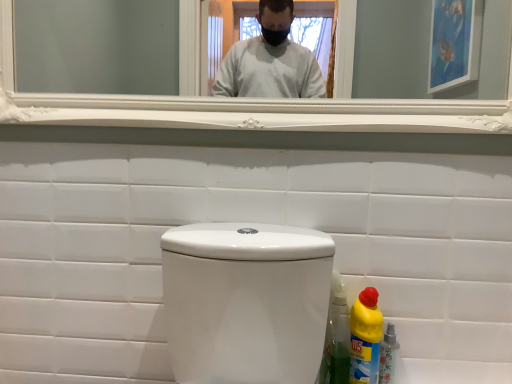
This screenshot has width=512, height=384. Describe the element at coordinates (97, 47) in the screenshot. I see `white glossy mirror at upper center` at that location.

How much space does yellow plastic bottle at lower right, the first bottle in the left-to-right sequence, occupy horizontally?

yellow plastic bottle at lower right, the first bottle in the left-to-right sequence, is 4.07 inches wide.

You are a GUI agent. You are given a task and a screenshot of the screen. Output one action in this format:
    pyautogui.click(x=<x>, y=<y>)
    Task: Click on the yellow plastic bottle at lower right, which is counted as the first bottle, starting from the right
    Image resolution: width=512 pixels, height=384 pixels.
    Given the screenshot: What is the action you would take?
    pyautogui.click(x=388, y=356)

Is white glossy mirror at upper center not close to yellow plastic bottle at lower right, positioned as the 2th bottle in left-to-right order?

white glossy mirror at upper center is positioned a significant distance from yellow plastic bottle at lower right, positioned as the 2th bottle in left-to-right order.

Is yellow plastic bottle at lower right, positioned as the 2th bottle in left-to-right order, at the back of white glossy mirror at upper center?

white glossy mirror at upper center is not turned away from yellow plastic bottle at lower right, positioned as the 2th bottle in left-to-right order.

From a real-world perspective, between white glossy mirror at upper center and yellow plastic bottle at lower right, which is counted as the first bottle, starting from the right, who is vertically lower?

In real-world perspective, yellow plastic bottle at lower right, which is counted as the first bottle, starting from the right, is lower.

Looking at this image, between white glossy mirror at upper center and yellow plastic bottle at lower right, positioned as the 2th bottle in left-to-right order, which one appears on the right side from the viewer's perspective?

Positioned to the right is yellow plastic bottle at lower right, positioned as the 2th bottle in left-to-right order.

Which of these two, yellow plastic bottle at lower right, positioned as the 2th bottle in left-to-right order, or white glossy toilet at center, stands taller?

white glossy toilet at center is taller.

Is yellow plastic bottle at lower right, positioned as the 2th bottle in left-to-right order, beside white glossy toilet at center?

yellow plastic bottle at lower right, positioned as the 2th bottle in left-to-right order, is not next to white glossy toilet at center, and they're not touching.

Measure the distance between yellow plastic bottle at lower right, positioned as the 2th bottle in left-to-right order, and white glossy toilet at center.

They are 18.90 inches apart.

Considering the relative sizes of yellow plastic bottle at lower right, which is counted as the first bottle, starting from the right, and white glossy toilet at center in the image provided, is yellow plastic bottle at lower right, which is counted as the first bottle, starting from the right, thinner than white glossy toilet at center?

No.

Which is behind, point (387, 369) or point (382, 328)?

Point (382, 328)

How different are the orientations of yellow plastic bottle at lower right, positioned as the 2th bottle in left-to-right order, and yellow plastic bottle at lower right, the first bottle in the left-to-right sequence, in degrees?

The angular difference between yellow plastic bottle at lower right, positioned as the 2th bottle in left-to-right order, and yellow plastic bottle at lower right, the first bottle in the left-to-right sequence, is 0.00522 degrees.

Which object is positioned more to the left, yellow plastic bottle at lower right, positioned as the 2th bottle in left-to-right order, or yellow plastic bottle at lower right, the first bottle in the left-to-right sequence?

yellow plastic bottle at lower right, the first bottle in the left-to-right sequence.

Can you confirm if yellow plastic bottle at lower right, which is counted as the first bottle, starting from the right, is wider than yellow plastic bottle at lower right, the first bottle in the left-to-right sequence?

Incorrect, the width of yellow plastic bottle at lower right, which is counted as the first bottle, starting from the right, does not surpass that of yellow plastic bottle at lower right, the first bottle in the left-to-right sequence.

Looking at this image, from a real-world perspective, between white glossy mirror at upper center and yellow plastic bottle at lower right, which appears as the 2th bottle when viewed from the right, who is vertically lower?

In real-world perspective, yellow plastic bottle at lower right, which appears as the 2th bottle when viewed from the right, is lower.

Is there a large distance between white glossy mirror at upper center and yellow plastic bottle at lower right, which appears as the 2th bottle when viewed from the right?

white glossy mirror at upper center is far away from yellow plastic bottle at lower right, which appears as the 2th bottle when viewed from the right.

The height and width of the screenshot is (384, 512). I want to click on the 1st bottle below the white glossy mirror at upper center (from a real-world perspective), so click(365, 338).

Is point (29, 49) closer to camera compared to point (354, 224)?

No, it is behind (354, 224).

Can you tell me how much white glossy mirror at upper center and white glossy toilet at center differ in facing direction?

There is a 0.182-degree angle between the facing directions of white glossy mirror at upper center and white glossy toilet at center.

Based on the photo, would you say white glossy toilet at center is part of white glossy mirror at upper center's contents?

That's incorrect, white glossy toilet at center is not inside white glossy mirror at upper center.

From a real-world perspective, which object rests below the other?

From a 3D spatial view, white glossy toilet at center is below.

Is yellow plastic bottle at lower right, positioned as the 2th bottle in left-to-right order, completely or partially inside yellow plastic bottle at lower right, the first bottle in the left-to-right sequence?

Definitely not — yellow plastic bottle at lower right, positioned as the 2th bottle in left-to-right order, is not inside yellow plastic bottle at lower right, the first bottle in the left-to-right sequence.

Based on the photo, which object is positioned more to the right, yellow plastic bottle at lower right, which appears as the 2th bottle when viewed from the right, or yellow plastic bottle at lower right, positioned as the 2th bottle in left-to-right order?

yellow plastic bottle at lower right, positioned as the 2th bottle in left-to-right order.

From the image's perspective, is yellow plastic bottle at lower right, which appears as the 2th bottle when viewed from the right, positioned above or below yellow plastic bottle at lower right, which is counted as the first bottle, starting from the right?

Clearly, from the image's perspective, yellow plastic bottle at lower right, which appears as the 2th bottle when viewed from the right, is above yellow plastic bottle at lower right, which is counted as the first bottle, starting from the right.

Is point (367, 338) closer to camera compared to point (394, 346)?

That is True.

Do you think yellow plastic bottle at lower right, the first bottle in the left-to-right sequence, is within white glossy toilet at center, or outside of it?

yellow plastic bottle at lower right, the first bottle in the left-to-right sequence, exists outside the volume of white glossy toilet at center.

Does point (356, 383) come in front of point (402, 280)?

Yes, it is in front of point (402, 280).

From a real-world perspective, who is located lower, yellow plastic bottle at lower right, which appears as the 2th bottle when viewed from the right, or white glossy toilet at center?

In real-world perspective, yellow plastic bottle at lower right, which appears as the 2th bottle when viewed from the right, is lower.

I want to click on mirror that appears above the yellow plastic bottle at lower right, positioned as the 2th bottle in left-to-right order (from a real-world perspective), so click(x=97, y=47).

This screenshot has width=512, height=384. Find the location of `porcelain in front of the yellow plastic bottle at lower right, positioned as the 2th bottle in left-to-right order`. porcelain in front of the yellow plastic bottle at lower right, positioned as the 2th bottle in left-to-right order is located at coordinates (247, 221).

From the image, which object appears to be farther from white glossy mirror at upper center, white glossy toilet at center or yellow plastic bottle at lower right, which appears as the 2th bottle when viewed from the right?

yellow plastic bottle at lower right, which appears as the 2th bottle when viewed from the right, lies further to white glossy mirror at upper center than the other object.

Considering their positions, is white glossy mirror at upper center positioned closer to yellow plastic bottle at lower right, which is counted as the first bottle, starting from the right, than white glossy toilet at center?

white glossy toilet at center is closer to yellow plastic bottle at lower right, which is counted as the first bottle, starting from the right.

When comparing their distances from yellow plastic bottle at lower right, which is counted as the first bottle, starting from the right, does white glossy toilet at center or white glossy mirror at upper center seem further?

Among the two, white glossy mirror at upper center is located further to yellow plastic bottle at lower right, which is counted as the first bottle, starting from the right.

Based on their spatial positions, is white glossy mirror at upper center or white glossy toilet at center further from yellow plastic bottle at lower right, which appears as the 2th bottle when viewed from the right?

The object further to yellow plastic bottle at lower right, which appears as the 2th bottle when viewed from the right, is white glossy mirror at upper center.

From the image, which object appears to be nearer to yellow plastic bottle at lower right, the first bottle in the left-to-right sequence, yellow plastic bottle at lower right, which is counted as the first bottle, starting from the right, or white glossy toilet at center?

yellow plastic bottle at lower right, which is counted as the first bottle, starting from the right.

When comparing their distances from white glossy mirror at upper center, does yellow plastic bottle at lower right, which appears as the 2th bottle when viewed from the right, or yellow plastic bottle at lower right, which is counted as the first bottle, starting from the right, seem closer?

yellow plastic bottle at lower right, which appears as the 2th bottle when viewed from the right, is closer to white glossy mirror at upper center.

From the image, which object appears to be nearer to yellow plastic bottle at lower right, positioned as the 2th bottle in left-to-right order, white glossy mirror at upper center or yellow plastic bottle at lower right, the first bottle in the left-to-right sequence?

yellow plastic bottle at lower right, the first bottle in the left-to-right sequence.

Which object lies nearer to the anchor point yellow plastic bottle at lower right, which is counted as the first bottle, starting from the right, yellow plastic bottle at lower right, the first bottle in the left-to-right sequence, or white glossy mirror at upper center?

Among the two, yellow plastic bottle at lower right, the first bottle in the left-to-right sequence, is located nearer to yellow plastic bottle at lower right, which is counted as the first bottle, starting from the right.

Find the location of a particular element. porcelain between white glossy mirror at upper center and yellow plastic bottle at lower right, which appears as the 2th bottle when viewed from the right, from top to bottom is located at coordinates (247, 221).

Locate an element on the screen. This screenshot has height=384, width=512. bottle between white glossy mirror at upper center and yellow plastic bottle at lower right, which is counted as the first bottle, starting from the right, in the vertical direction is located at coordinates (365, 338).

Identify the location of porcelain between white glossy mirror at upper center and yellow plastic bottle at lower right, positioned as the 2th bottle in left-to-right order, in the vertical direction. Image resolution: width=512 pixels, height=384 pixels. (247, 221).

Where is `bottle between white glossy toilet at center and yellow plastic bottle at lower right, which is counted as the first bottle, starting from the right, in the horizontal direction`? This screenshot has width=512, height=384. bottle between white glossy toilet at center and yellow plastic bottle at lower right, which is counted as the first bottle, starting from the right, in the horizontal direction is located at coordinates (365, 338).